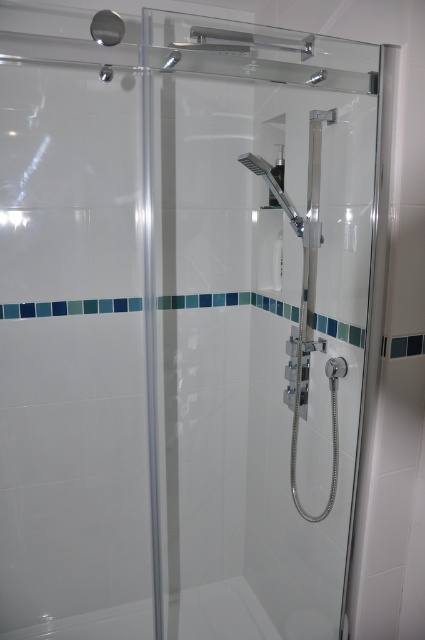
You are standing in front of the shower enclosure and want to place a small soap dish on the white glossy bath at lower center. Where exactly should you place it?

You should place the small soap dish at the coordinates point (223, 612) on the white glossy bath at lower center.

You are standing in the bathroom and want to step into the shower. The white glossy bath at lower center is in your way. Can you walk around it to access the shower area?

The white glossy bath at lower center is 6.12 feet away from you, so you can walk around it to access the shower area since the distance allows enough space to maneuver around the bath.

You are standing in front of the shower enclosure and want to reach the horizontal bar at the top of the glass door. The point you need to touch is located at point (203, 616). Considering your height and arm reach, if your total reach is 6 feet, can you comfortably reach that point?

The distance between you and point (203, 616) is 6.62 feet, which exceeds your total reach of 6 feet. Therefore, you cannot comfortably reach the horizontal bar at the top of the glass door.